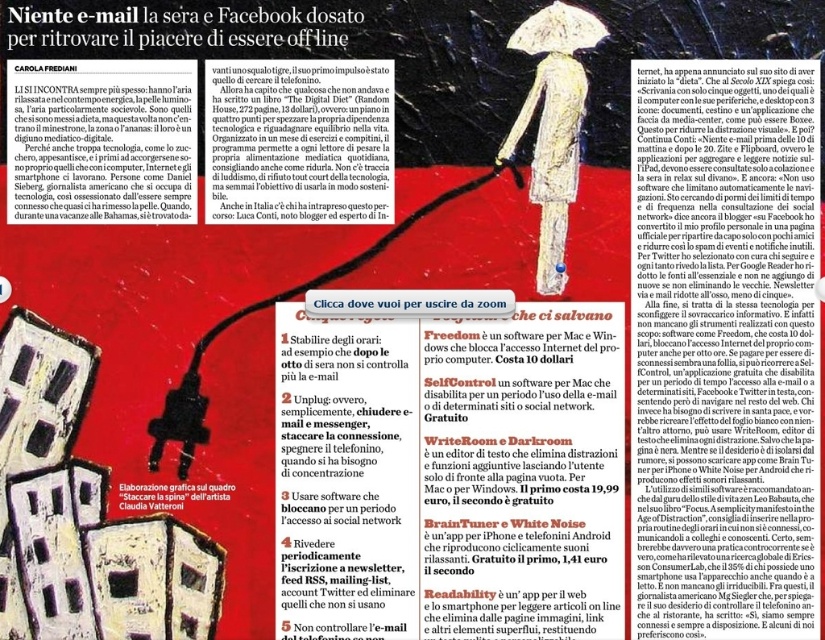
You are a graphic designer reviewing this magazine layout. You need to place a new element between the two points, point (x=733, y=564) and point (x=10, y=52). Which point should the new element be closer to to maintain visual balance?

The new element should be closer to point (x=10, y=52) because point (x=733, y=564) is further away from the viewer, creating a balanced composition.

You are designing a layout for a magazine article and need to place the black paper text at upper right and the white paper text at center. According to the provided image, which text element is located to the right of the other?

The black paper text at upper right is positioned on the right side of white paper text at center.

Based on the scene description, what can you infer about the relationship between the white paper text at center and the black paper text at upper center in terms of their size?

The white paper text at center is larger in size than the black paper text at upper center.